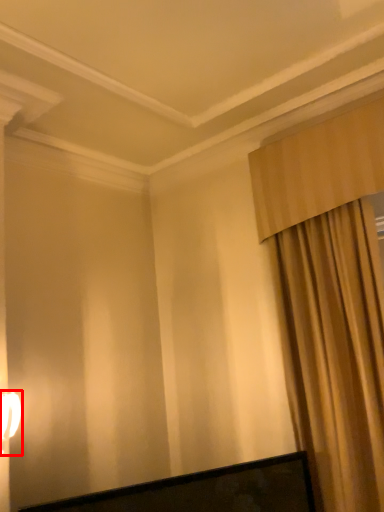
Question: From the image's perspective, where is table lamp (annotated by the red box) located in relation to curtain in the image?

Choices:
 (A) below
 (B) above

Answer: (A)